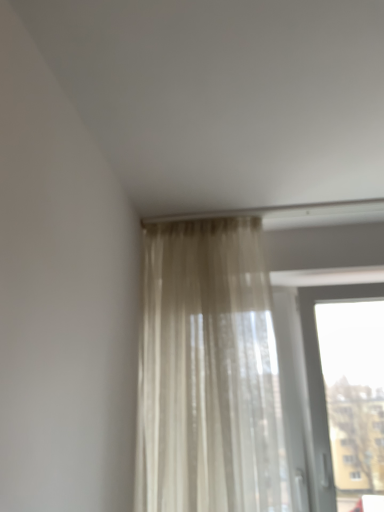
Describe the element at coordinates (322, 388) in the screenshot. I see `transparent glass window at upper right` at that location.

Where is `transparent glass window at upper right`? This screenshot has width=384, height=512. transparent glass window at upper right is located at coordinates (322, 388).

What do you see at coordinates (208, 372) in the screenshot? I see `sheer beige curtain at upper center` at bounding box center [208, 372].

In order to face sheer beige curtain at upper center, should I rotate leftwards or rightwards?

To align with it, rotate right about 2.844°.

Identify the location of sheer beige curtain at upper center. The height and width of the screenshot is (512, 384). (208, 372).

What are the coordinates of `transparent glass window at upper right` in the screenshot? It's located at (322, 388).

Considering the relative positions of sheer beige curtain at upper center and transparent glass window at upper right in the image provided, is sheer beige curtain at upper center to the left of transparent glass window at upper right from the viewer's perspective?

Indeed, sheer beige curtain at upper center is positioned on the left side of transparent glass window at upper right.

Which object is further away from the camera, sheer beige curtain at upper center or transparent glass window at upper right?

Positioned behind is transparent glass window at upper right.

Which is in front, point (169, 426) or point (320, 387)?

Point (169, 426)

From the image's perspective, relative to transparent glass window at upper right, is sheer beige curtain at upper center above or below?

Clearly, from the image's perspective, sheer beige curtain at upper center is above transparent glass window at upper right.

From a real-world perspective, who is located higher, sheer beige curtain at upper center or transparent glass window at upper right?

sheer beige curtain at upper center, from a real-world perspective.

Which of these two, sheer beige curtain at upper center or transparent glass window at upper right, is wider?

transparent glass window at upper right.

From their relative heights in the image, would you say sheer beige curtain at upper center is taller or shorter than transparent glass window at upper right?

sheer beige curtain at upper center is taller than transparent glass window at upper right.

In the scene shown: Is sheer beige curtain at upper center bigger than transparent glass window at upper right?

Yes, sheer beige curtain at upper center is bigger than transparent glass window at upper right.

Can transparent glass window at upper right be found inside sheer beige curtain at upper center?

No, transparent glass window at upper right is not a part of sheer beige curtain at upper center.

Is there a large distance between sheer beige curtain at upper center and transparent glass window at upper right?

No, there isn't a large distance between sheer beige curtain at upper center and transparent glass window at upper right.

Is sheer beige curtain at upper center facing away from transparent glass window at upper right?

No, sheer beige curtain at upper center is not facing away from transparent glass window at upper right.

Measure the distance between sheer beige curtain at upper center and transparent glass window at upper right.

The distance of sheer beige curtain at upper center from transparent glass window at upper right is 17.66 inches.

This screenshot has width=384, height=512. In the image, there is a sheer beige curtain at upper center. What are the coordinates of `window below it (from the image's perspective)` in the screenshot? It's located at (322, 388).

Considering the relative positions of transparent glass window at upper right and sheer beige curtain at upper center in the image provided, is transparent glass window at upper right to the left or to the right of sheer beige curtain at upper center?

From the image, it's evident that transparent glass window at upper right is to the right of sheer beige curtain at upper center.

Does transparent glass window at upper right lie in front of sheer beige curtain at upper center?

No, transparent glass window at upper right is further to the viewer.

Considering the points (311, 336) and (237, 278), which point is behind, point (311, 336) or point (237, 278)?

Positioned behind is point (311, 336).

From the image's perspective, is transparent glass window at upper right on sheer beige curtain at upper center?

No, from the image's perspective, transparent glass window at upper right is not on top of sheer beige curtain at upper center.

From a real-world perspective, is transparent glass window at upper right positioned over sheer beige curtain at upper center based on gravity?

No.

Does transparent glass window at upper right have a greater width compared to sheer beige curtain at upper center?

Correct, the width of transparent glass window at upper right exceeds that of sheer beige curtain at upper center.

In terms of height, does transparent glass window at upper right look taller or shorter compared to sheer beige curtain at upper center?

transparent glass window at upper right is shorter than sheer beige curtain at upper center.

Is transparent glass window at upper right bigger or smaller than sheer beige curtain at upper center?

In the image, transparent glass window at upper right appears to be smaller than sheer beige curtain at upper center.

Is sheer beige curtain at upper center located within transparent glass window at upper right?

No.

Would you consider transparent glass window at upper right to be distant from sheer beige curtain at upper center?

No, transparent glass window at upper right is not far from sheer beige curtain at upper center.

Could you tell me if transparent glass window at upper right is facing sheer beige curtain at upper center?

No, transparent glass window at upper right does not turn towards sheer beige curtain at upper center.

How different are the orientations of transparent glass window at upper right and sheer beige curtain at upper center in degrees?

1.52 degrees separate the facing orientations of transparent glass window at upper right and sheer beige curtain at upper center.

You are a GUI agent. You are given a task and a screenshot of the screen. Output one action in this format:
    pyautogui.click(x=<x>, y=<y>)
    Task: Click on the curtain above the transparent glass window at upper right (from the image's perspective)
    Image resolution: width=384 pixels, height=512 pixels.
    Given the screenshot: What is the action you would take?
    pyautogui.click(x=208, y=372)

Where is `curtain on the left side of transparent glass window at upper right`? This screenshot has width=384, height=512. curtain on the left side of transparent glass window at upper right is located at coordinates (208, 372).

The width and height of the screenshot is (384, 512). What are the coordinates of `curtain above the transparent glass window at upper right (from the image's perspective)` in the screenshot? It's located at (208, 372).